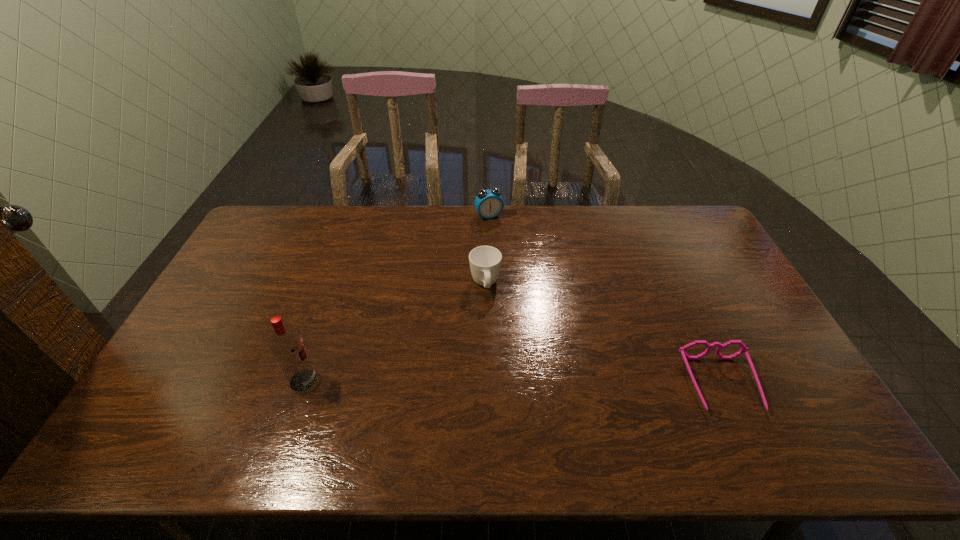
What are the coordinates of `vacant region at the right edge` in the screenshot? It's located at (763, 330).

What are the coordinates of `free space between the leftmost object and the third nearest object` in the screenshot? It's located at (395, 333).

Image resolution: width=960 pixels, height=540 pixels. Identify the location of vacant point located between the rightmost object and the leftmost object. (512, 382).

Image resolution: width=960 pixels, height=540 pixels. I want to click on vacant space that is in between the cup and the tallest object, so [395, 333].

Locate an element on the screen. This screenshot has height=540, width=960. vacant space that is in between the alarm clock and the spectacles is located at coordinates (605, 300).

Where is `vacant area that lies between the cup and the leftmost object`? vacant area that lies between the cup and the leftmost object is located at coordinates click(395, 333).

This screenshot has height=540, width=960. What are the coordinates of `vacant space in between the shortest object and the second farthest object` in the screenshot? It's located at (603, 335).

In order to click on free area in between the shortest object and the third nearest object in this screenshot , I will do `click(603, 335)`.

At what (x,y) coordinates should I click in order to perform the action: click on object identified as the third closest to the leftmost object. Please return your answer as a coordinate pair (x, y). Looking at the image, I should click on (744, 349).

Locate which object ranks third in proximity to the alarm clock. Please provide its 2D coordinates. Your answer should be formatted as a tuple, i.e. [(x, y)], where the tuple contains the x and y coordinates of a point satisfying the conditions above.

[(286, 343)]